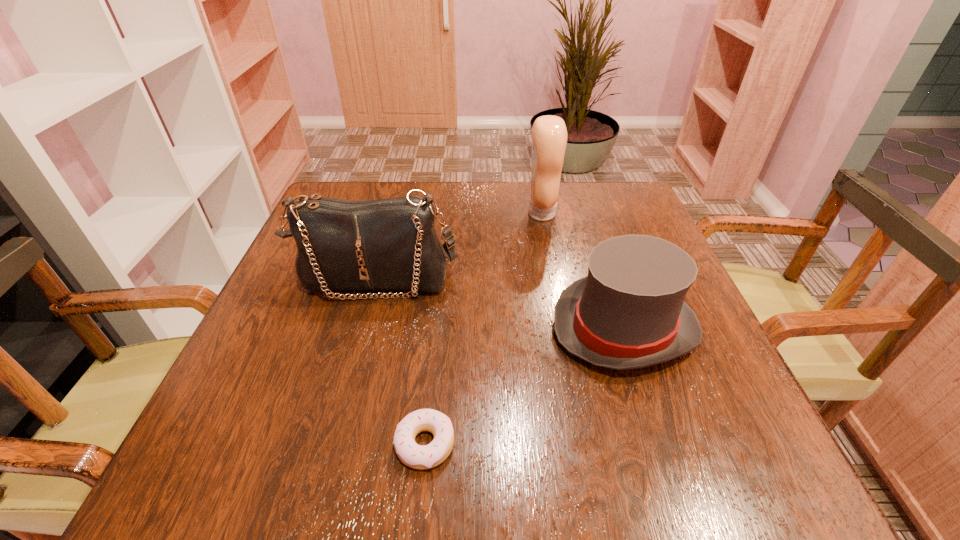
Identify the location of empty space that is in between the dress hat and the doughnut. (524, 386).

This screenshot has height=540, width=960. In order to click on empty space that is in between the nearest object and the dress hat in this screenshot , I will do `click(524, 386)`.

What are the coordinates of `free area in between the shortest object and the dress hat` in the screenshot? It's located at (524, 386).

The image size is (960, 540). Identify the location of free point between the nearest object and the handbag. (400, 362).

I want to click on empty space between the handbag and the condiment, so click(x=459, y=247).

This screenshot has height=540, width=960. In order to click on empty space between the handbag and the doughnut in this screenshot , I will do `click(400, 362)`.

The width and height of the screenshot is (960, 540). In order to click on vacant space that is in between the handbag and the shortest object in this screenshot , I will do `click(400, 362)`.

Where is `empty space that is in between the doughnut and the dress hat`? The height and width of the screenshot is (540, 960). empty space that is in between the doughnut and the dress hat is located at coordinates (x=524, y=386).

This screenshot has height=540, width=960. In order to click on vacant area between the dress hat and the doughnut in this screenshot , I will do `click(524, 386)`.

This screenshot has width=960, height=540. I want to click on vacant area that lies between the second shortest object and the handbag, so click(500, 304).